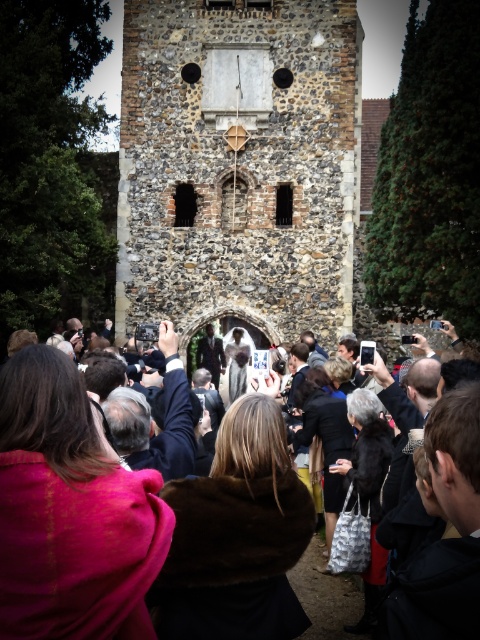
Is point (207, 42) farther from viewer compared to point (10, 604)?

Yes, point (207, 42) is farther from viewer.

Can you confirm if stone clock tower at center is positioned to the right of dark brown fur coat at center?

Correct, you'll find stone clock tower at center to the right of dark brown fur coat at center.

Locate an element on the screen. Image resolution: width=480 pixels, height=640 pixels. stone clock tower at center is located at coordinates (239, 164).